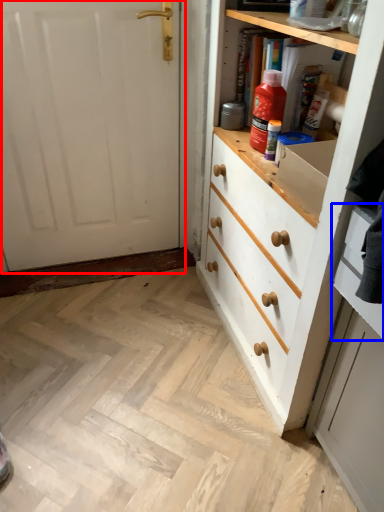
Question: Which point is closer to the camera, door (highlighted by a red box) or drawer (highlighted by a blue box)?

Choices:
 (A) door
 (B) drawer

Answer: (B)